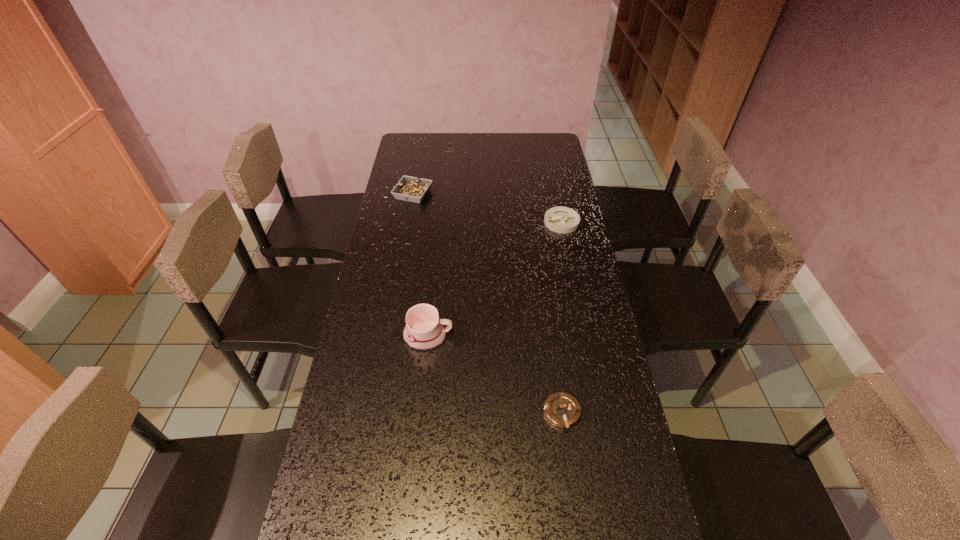
Where is `blank space located 0.170m on the left of the shortest object`? The width and height of the screenshot is (960, 540). blank space located 0.170m on the left of the shortest object is located at coordinates [x=478, y=413].

Where is `mug present at the left edge`? mug present at the left edge is located at coordinates (424, 331).

The image size is (960, 540). Find the location of `ashtray at the left edge`. ashtray at the left edge is located at coordinates pyautogui.click(x=411, y=189).

Identify the location of vacant space at the far edge. The image size is (960, 540). click(520, 145).

Image resolution: width=960 pixels, height=540 pixels. What are the coordinates of `free space at the left edge of the desktop` in the screenshot? It's located at (392, 426).

Where is `vacant space at the right edge of the desktop`? This screenshot has height=540, width=960. vacant space at the right edge of the desktop is located at coordinates (555, 177).

The image size is (960, 540). I want to click on free space at the far left corner of the desktop, so [x=429, y=155].

In order to click on vacant region between the third farthest object and the second farthest ashtray in this screenshot , I will do `click(495, 279)`.

Find the location of `empty space that is in between the third farthest object and the third nearest object`. empty space that is in between the third farthest object and the third nearest object is located at coordinates (495, 279).

Find the location of a particular element. This screenshot has height=540, width=960. vacant space in between the leftmost ashtray and the third farthest object is located at coordinates [420, 265].